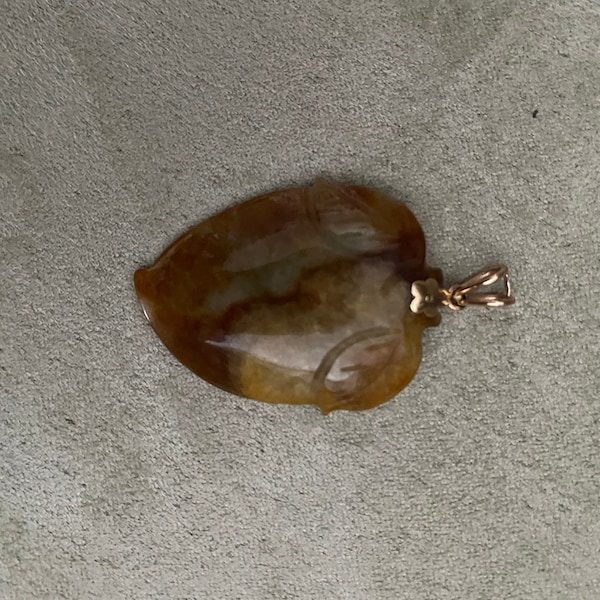
What are the coordinates of `carpet` in the screenshot? It's located at (306, 539), (58, 347), (117, 116), (535, 207).